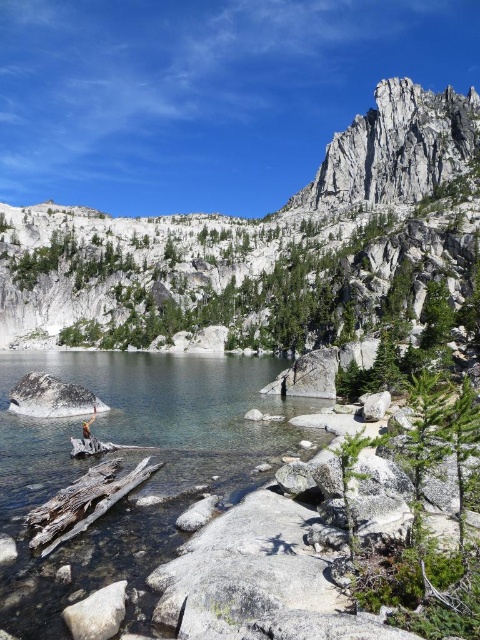
You are a hiker who has just arrived at the lakeshore. You see a gray granite rock at center and a brown leather jacket at center. Which object is positioned higher in the scene?

The gray granite rock at center is located above the brown leather jacket at center, so it is positioned higher in the scene.